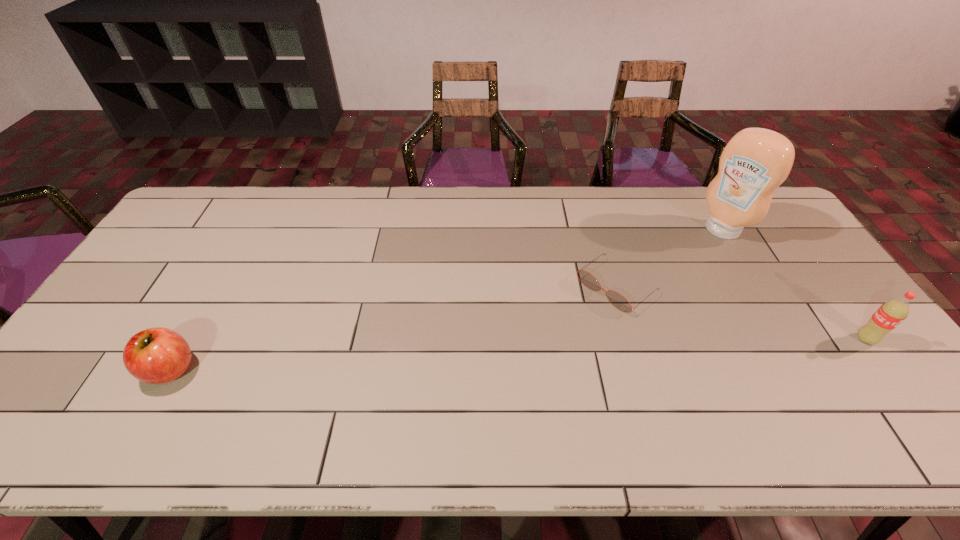
Locate an element on the screen. free space on the desktop that is between the leftmost object and the rightmost object and is positioned on the label of the farthest object is located at coordinates (567, 352).

Locate an element on the screen. vacant space on the desktop that is between the apple and the soda and is positioned on the face of the third object from right to left is located at coordinates (530, 354).